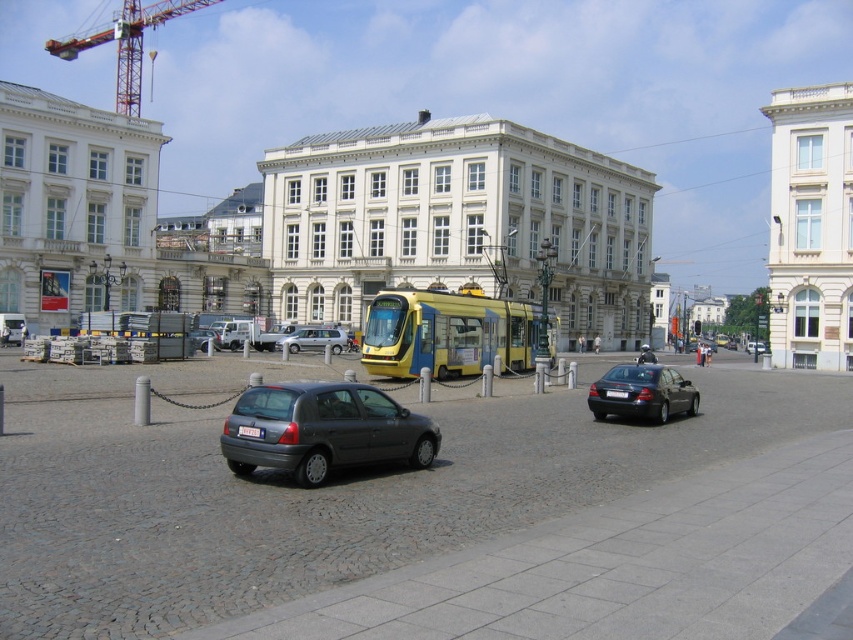
Based on the photo, you are standing at the point with coordinates point (x=213, y=346) and want to walk towards the tram. Is the point (x=492, y=305) in your path?

Yes, the point (x=492, y=305) is in front of point (x=213, y=346), so it is in your path towards the tram.

Based on the photo, you are a delivery person who needs to load a tall package into your van. The package is 2 meters tall. You see the yellow metallic tram at center and the matte gray hatchback at center in the plaza. Which vehicle has enough vertical space to accommodate the package?

The yellow metallic tram at center is much taller than the matte gray hatchback at center, so the yellow metallic tram at center has enough vertical space to accommodate the 2 meter tall package.